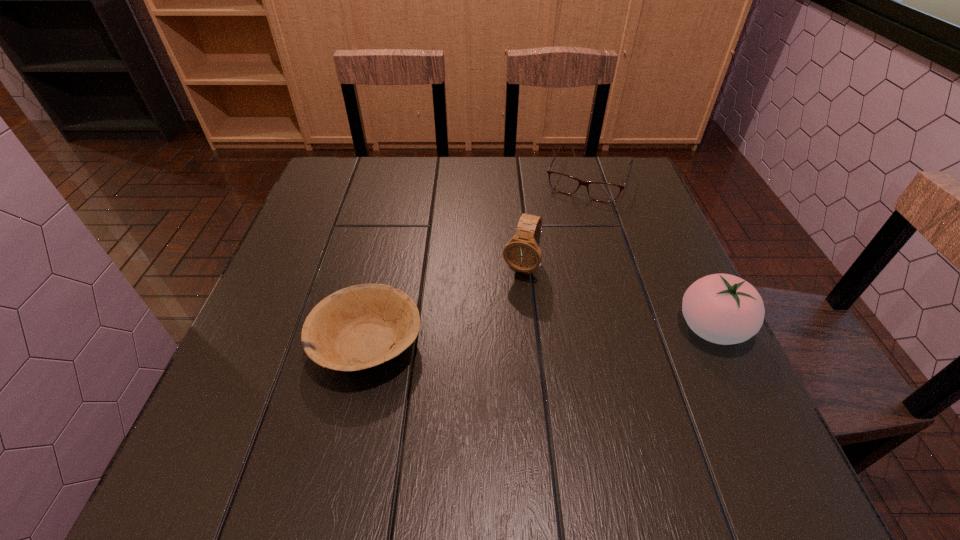
At what (x,y) coordinates should I click in order to perform the action: click on free space between the farthest object and the tomato. Please return your answer as a coordinate pair (x, y). The width and height of the screenshot is (960, 540). Looking at the image, I should click on (650, 253).

Locate an element on the screen. free space that is in between the leftmost object and the spectacles is located at coordinates (478, 261).

Locate an element on the screen. This screenshot has width=960, height=540. free space between the leftmost object and the second object from left to right is located at coordinates (444, 306).

Find the location of a particular element. The width and height of the screenshot is (960, 540). vacant area that lies between the farthest object and the leftmost object is located at coordinates (478, 261).

Locate an element on the screen. This screenshot has width=960, height=540. vacant region between the bowl and the third nearest object is located at coordinates (444, 306).

Locate an element on the screen. This screenshot has width=960, height=540. free point between the tomato and the leftmost object is located at coordinates (540, 336).

Point out which object is positioned as the nearest to the second farthest object. Please provide its 2D coordinates. Your answer should be formatted as a tuple, i.e. [(x, y)], where the tuple contains the x and y coordinates of a point satisfying the conditions above.

[(361, 326)]

At what (x,y) coordinates should I click in order to perform the action: click on object that is the third closest to the spectacles. Please return your answer as a coordinate pair (x, y). This screenshot has height=540, width=960. Looking at the image, I should click on (361, 326).

Where is `vacant space that satisfies the following two spatial constraints: 1. on the back side of the leftmost object; 2. on the left side of the second farthest object`? This screenshot has width=960, height=540. vacant space that satisfies the following two spatial constraints: 1. on the back side of the leftmost object; 2. on the left side of the second farthest object is located at coordinates (384, 268).

At what (x,y) coordinates should I click in order to perform the action: click on vacant space that satisfies the following two spatial constraints: 1. on the front side of the tomato; 2. on the left side of the second farthest object. Please return your answer as a coordinate pair (x, y). Image resolution: width=960 pixels, height=540 pixels. Looking at the image, I should click on (527, 328).